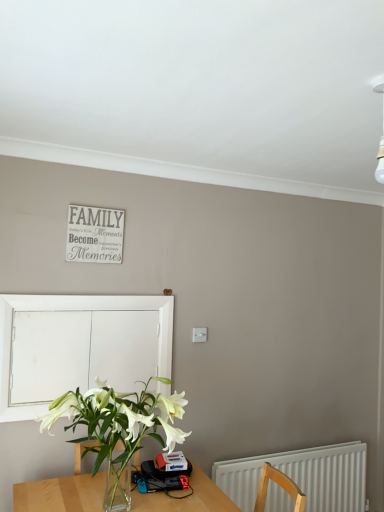
Find the location of a particular element. The image size is (384, 512). white matte signboard at upper center is located at coordinates (95, 234).

Locate an element on the screen. white matte signboard at upper center is located at coordinates (95, 234).

Is white plastic radiator at lower right situated inside white matte signboard at upper center or outside?

white plastic radiator at lower right is located beyond the bounds of white matte signboard at upper center.

From a real-world perspective, between white plastic radiator at lower right and white matte signboard at upper center, who is vertically lower?

white plastic radiator at lower right is physically lower.

Based on the photo, is there a large distance between white plastic radiator at lower right and white matte signboard at upper center?

Yes, white plastic radiator at lower right and white matte signboard at upper center are located far from each other.

In the image, is white plastic radiator at lower right positioned in front of or behind white matte signboard at upper center?

Clearly, white plastic radiator at lower right is behind white matte signboard at upper center.

Does white matte window screen at left have a larger size compared to white matte signboard at upper center?

Correct, white matte window screen at left is larger in size than white matte signboard at upper center.

Is white matte window screen at left not inside white matte signboard at upper center?

Yes, white matte window screen at left is located beyond the bounds of white matte signboard at upper center.

From the image's perspective, does white matte window screen at left appear lower than white matte signboard at upper center?

Yes, from the image's perspective, white matte window screen at left is beneath white matte signboard at upper center.

Is white matte window screen at left far from white plastic radiator at lower right?

white matte window screen at left is positioned a significant distance from white plastic radiator at lower right.

Is white matte window screen at left smaller than white plastic radiator at lower right?

Yes, white matte window screen at left is smaller than white plastic radiator at lower right.

From a real-world perspective, is white matte window screen at left located beneath white plastic radiator at lower right?

Incorrect, from a real-world perspective, white matte window screen at left is higher than white plastic radiator at lower right.

Considering the relative positions of white matte window screen at left and white plastic radiator at lower right in the image provided, is white matte window screen at left in front of white plastic radiator at lower right?

Yes, white matte window screen at left is closer to the camera.

Is white plastic radiator at lower right oriented away from white matte window screen at left?

That's not correct — white plastic radiator at lower right is not looking away from white matte window screen at left.

Is white plastic radiator at lower right not close to white matte window screen at left?

That's right, there is a large distance between white plastic radiator at lower right and white matte window screen at left.

From the image's perspective, is white plastic radiator at lower right under white matte window screen at left?

Answer: Yes, from the image's perspective, white plastic radiator at lower right is below white matte window screen at left.

From a real-world perspective, relative to white matte window screen at left, is white plastic radiator at lower right vertically above or below?

From a real-world perspective, white plastic radiator at lower right is physically below white matte window screen at left.

I want to click on window screen lying on the left of white matte signboard at upper center, so click(80, 310).

What's the angular difference between white matte signboard at upper center and white matte window screen at left's facing directions?

The facing directions of white matte signboard at upper center and white matte window screen at left are 1.77 degrees apart.

From a real-world perspective, is white matte signboard at upper center above or below white matte window screen at left?

Clearly, from a real-world perspective, white matte signboard at upper center is above white matte window screen at left.

Does white matte signboard at upper center turn towards white matte window screen at left?

No, white matte signboard at upper center is not oriented towards white matte window screen at left.

Looking at this image, considering the positions of objects white matte signboard at upper center and white plastic radiator at lower right in the image provided, who is more to the left, white matte signboard at upper center or white plastic radiator at lower right?

white matte signboard at upper center.

Which of these two, white matte signboard at upper center or white plastic radiator at lower right, is thinner?

With smaller width is white matte signboard at upper center.

From the picture: Which is farther, (72, 244) or (228, 474)?

Point (72, 244)

In the image, there is a white matte signboard at upper center. Identify the location of radiator below it (from the image's perspective). point(302,476).

Find the location of a particular element. bulletin board behind the white matte window screen at left is located at coordinates (95, 234).

Considering their positions, is white plastic radiator at lower right positioned further to white matte signboard at upper center than white matte window screen at left?

white plastic radiator at lower right lies further to white matte signboard at upper center than the other object.

Based on their spatial positions, is white plastic radiator at lower right or white matte signboard at upper center further from white matte window screen at left?

The object further to white matte window screen at left is white plastic radiator at lower right.

Which object lies further to the anchor point white plastic radiator at lower right, white matte signboard at upper center or white matte window screen at left?

Among the two, white matte signboard at upper center is located further to white plastic radiator at lower right.

Estimate the real-world distances between objects in this image. Which object is further from white matte window screen at left, white matte signboard at upper center or white plastic radiator at lower right?

The object further to white matte window screen at left is white plastic radiator at lower right.

Estimate the real-world distances between objects in this image. Which object is closer to white plastic radiator at lower right, white matte window screen at left or white matte signboard at upper center?

white matte window screen at left is closer to white plastic radiator at lower right.

Looking at this image, considering their positions, is white matte window screen at left positioned further to white matte signboard at upper center than white plastic radiator at lower right?

white plastic radiator at lower right.

Locate an element on the screen. window screen that lies between white matte signboard at upper center and white plastic radiator at lower right from top to bottom is located at coordinates (80, 310).